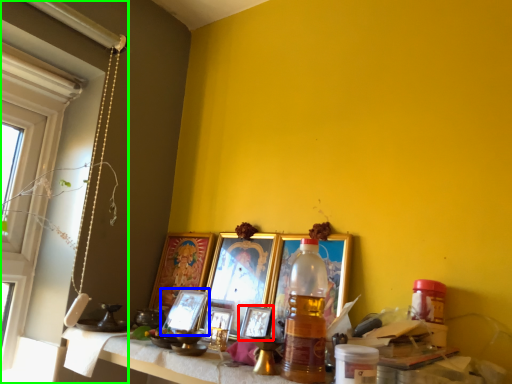
Question: Which object is the closest to the picture frame (highlighted by a red box)? Choose among these: picture frame (highlighted by a blue box) or window (highlighted by a green box).

Choices:
 (A) picture frame
 (B) window

Answer: (A)